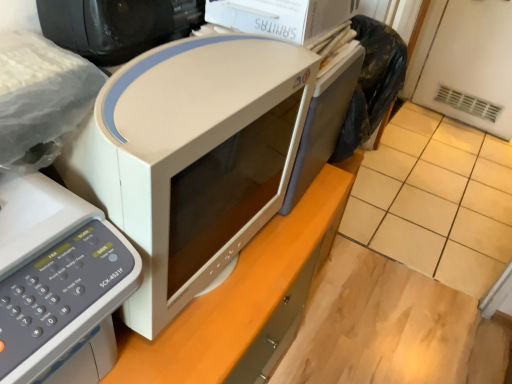
Question: From the image's perspective, is black glossy desktop computer at upper left above or below beige tile at center?

Choices:
 (A) above
 (B) below

Answer: (A)

Question: Considering the relative positions of black glossy desktop computer at upper left and beige tile at center in the image provided, is black glossy desktop computer at upper left to the left or to the right of beige tile at center?

Choices:
 (A) right
 (B) left

Answer: (B)

Question: Which object is positioned farthest from the beige tile at center?

Choices:
 (A) white matte microwave at left, the second home appliance when ordered from right to left
 (B) white matte microwave at center, which is counted as the second home appliance, starting from the left
 (C) black glossy desktop computer at upper left
 (D) white matte computer desk at center

Answer: (A)

Question: Which is nearer to the beige tile at center?

Choices:
 (A) white matte computer desk at center
 (B) white matte microwave at center, which is counted as the second home appliance, starting from the left
 (C) white matte microwave at left, the first home appliance positioned from the left
 (D) black glossy desktop computer at upper left

Answer: (A)